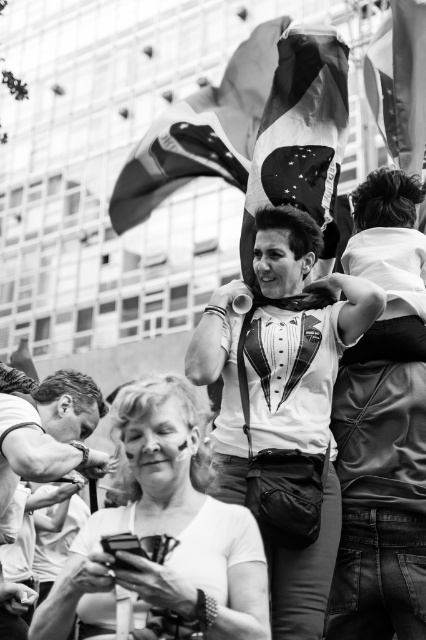
Measure the distance between point (x=204, y=580) and camera.

41.11 meters

Does point (166, 474) lie behind point (55, 401)?

No, it is in front of (55, 401).

Where is `white matte shirt at center`? This screenshot has height=640, width=426. white matte shirt at center is located at coordinates (163, 534).

Between white matte tuxedo shirt at center and smooth leather watch at lower left, which one appears on the left side from the viewer's perspective?

Positioned to the left is smooth leather watch at lower left.

Can you confirm if white matte tuxedo shirt at center is wider than smooth leather watch at lower left?

Correct, the width of white matte tuxedo shirt at center exceeds that of smooth leather watch at lower left.

Where is `white matte tuxedo shirt at center`? This screenshot has height=640, width=426. white matte tuxedo shirt at center is located at coordinates (299, 333).

Who is positioned more to the right, white matte tuxedo shirt at center or american flag at upper right?

Positioned to the right is american flag at upper right.

Does white matte tuxedo shirt at center lie in front of american flag at upper right?

That is True.

Is point (296, 237) positioned in front of point (379, 108)?

Yes, it is in front of point (379, 108).

You are a GUI agent. You are given a task and a screenshot of the screen. Output one action in this format:
    pyautogui.click(x=<x>, y=<y>)
    Task: Click on the white matte tuxedo shirt at center
    Image resolution: width=426 pixels, height=640 pixels.
    Given the screenshot: What is the action you would take?
    pyautogui.click(x=299, y=333)